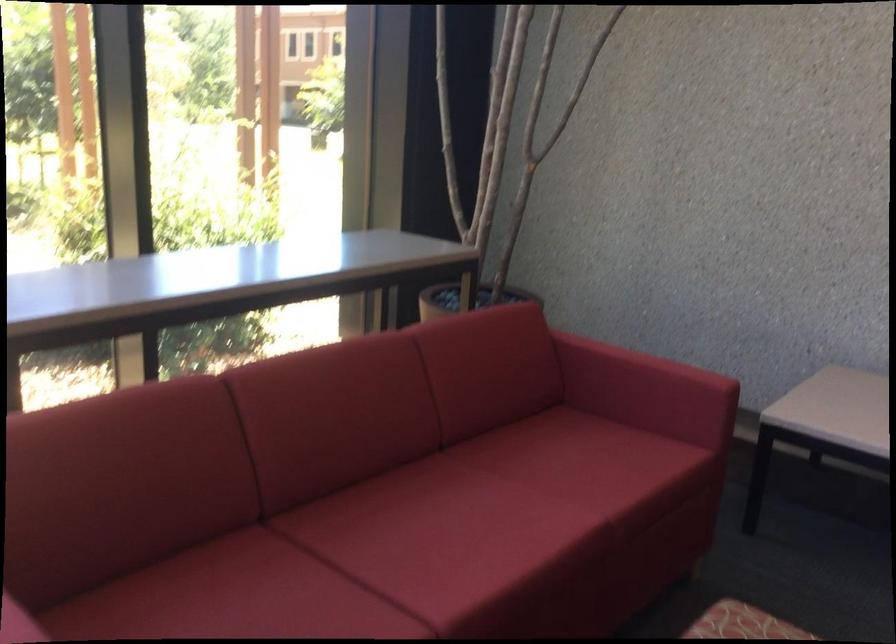
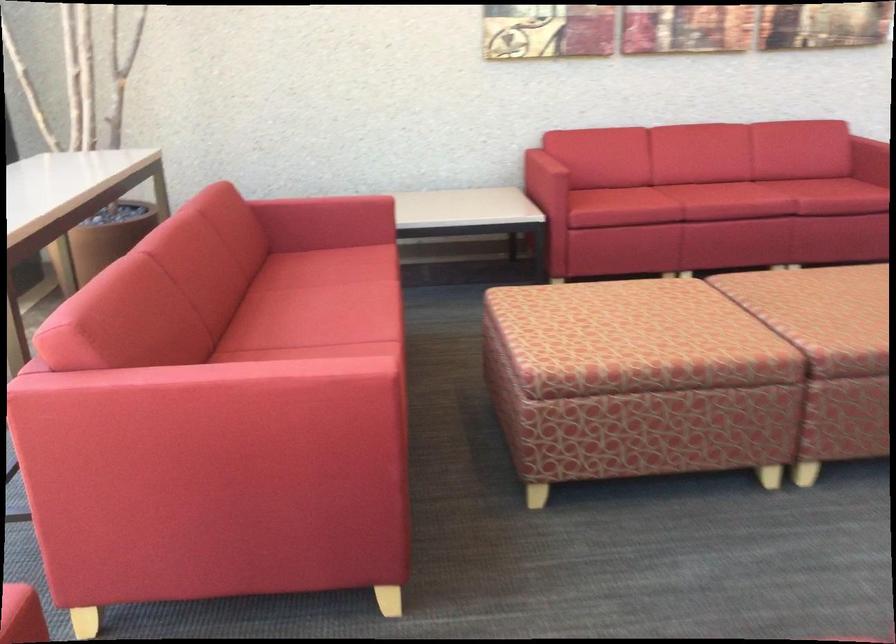
The point at (504, 502) is marked in the first image. Where is the corresponding point in the second image?

(334, 295)